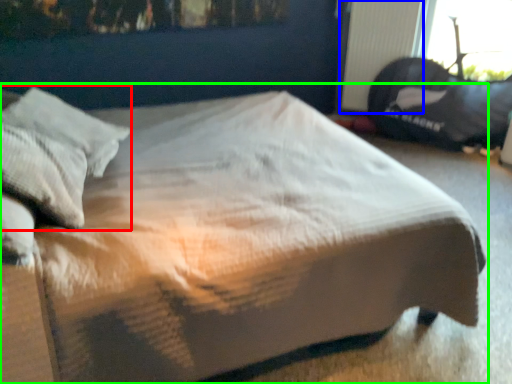
Question: Considering the real-world distances, which object is closest to pillow (highlighted by a red box)? radiator (highlighted by a blue box) or bed (highlighted by a green box).

Choices:
 (A) radiator
 (B) bed

Answer: (B)